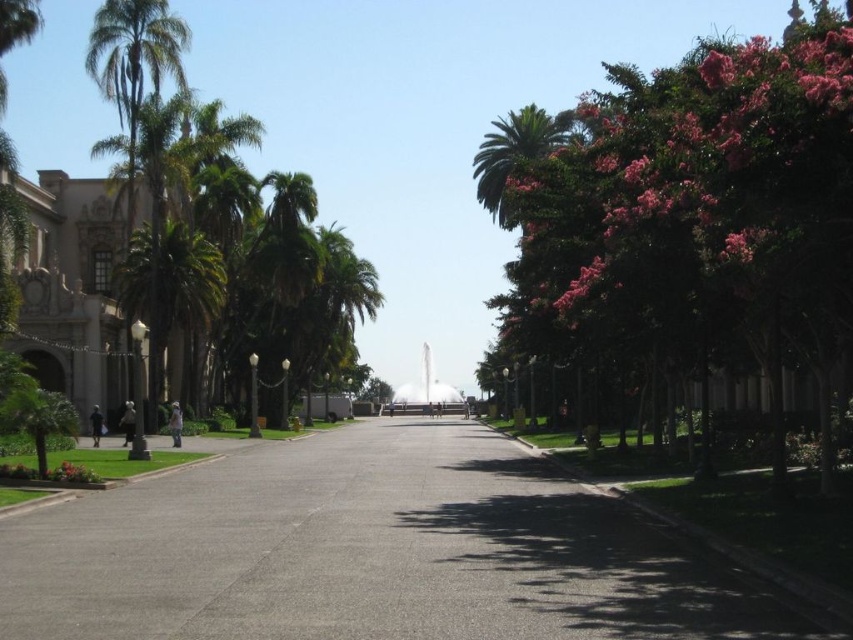
Question: Is gray asphalt pavement at center bigger than green leafy palm tree at left?

Choices:
 (A) no
 (B) yes

Answer: (B)

Question: Which of the following is the farthest from the observer?

Choices:
 (A) (715, 148)
 (B) (193, 244)
 (C) (468, 508)

Answer: (B)

Question: Is gray asphalt pavement at center smaller than green leafy palm tree at left?

Choices:
 (A) yes
 (B) no

Answer: (B)

Question: Which is nearer to the green leafy palm tree at left?

Choices:
 (A) green leafy tree at right
 (B) gray asphalt pavement at center

Answer: (B)

Question: Is green leafy tree at right positioned before green leafy palm tree at left?

Choices:
 (A) no
 (B) yes

Answer: (B)

Question: Which of the following is the farthest from the observer?

Choices:
 (A) (198, 252)
 (B) (85, 497)

Answer: (A)